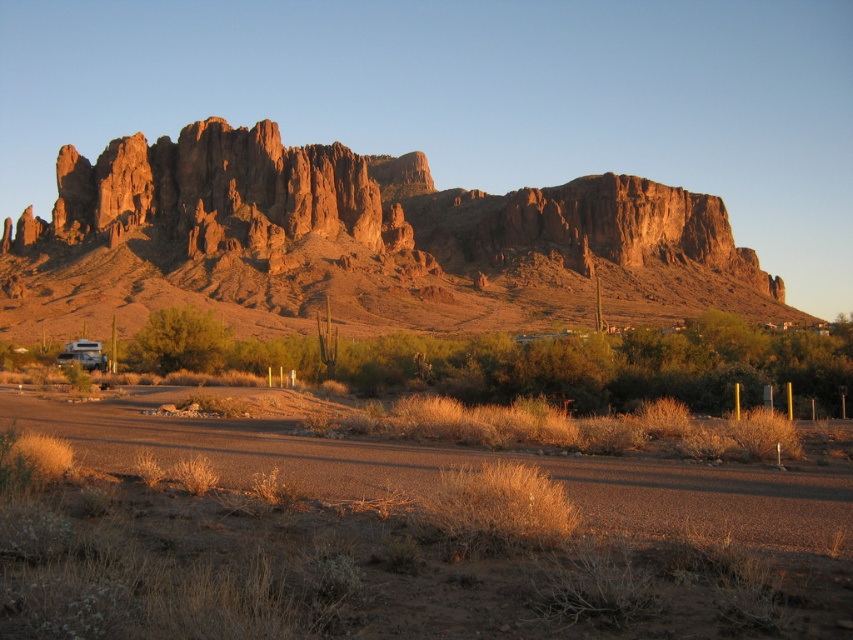
You are a hiker who wants to take a photo of the matte silver rv at lower left. Where should you position yourself relative to the dry grass at center to get the best shot?

You should position yourself to the left of the dry grass at center because the matte silver rv at lower left is located to the left of the dry grass at center.

In the scene shown: You are a hiker trying to cross the desert and need to know which object is narrower between the dry grass at center and the rustic rock formation at upper center. Can you tell me which one is narrower?

The dry grass at center has a lesser width compared to the rustic rock formation at upper center, so the dry grass at center is narrower.